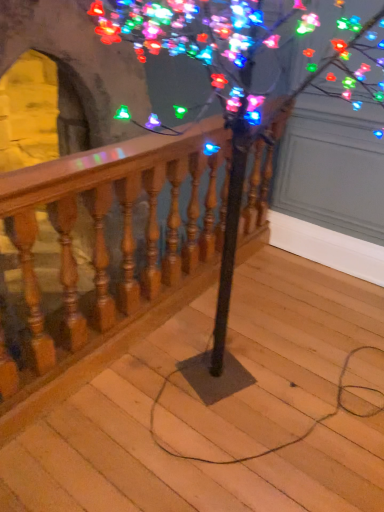
Question: Is multicolored lights at upper center positioned beyond the bounds of wooden at center?

Choices:
 (A) no
 (B) yes

Answer: (B)

Question: Does multicolored lights at upper center have a greater width compared to wooden at center?

Choices:
 (A) yes
 (B) no

Answer: (B)

Question: Is multicolored lights at upper center taller than wooden at center?

Choices:
 (A) yes
 (B) no

Answer: (A)

Question: Can you confirm if multicolored lights at upper center is smaller than wooden at center?

Choices:
 (A) no
 (B) yes

Answer: (A)

Question: Does multicolored lights at upper center have a larger size compared to wooden at center?

Choices:
 (A) yes
 (B) no

Answer: (A)

Question: Is multicolored lights at upper center thinner than wooden at center?

Choices:
 (A) no
 (B) yes

Answer: (B)

Question: Does multicolored lights at upper center come behind wooden baluster at center?

Choices:
 (A) yes
 (B) no

Answer: (B)

Question: From the image's perspective, does multicolored lights at upper center appear higher than wooden baluster at center?

Choices:
 (A) no
 (B) yes

Answer: (A)

Question: Is multicolored lights at upper center looking in the opposite direction of wooden baluster at center?

Choices:
 (A) yes
 (B) no

Answer: (A)

Question: Is multicolored lights at upper center wider than wooden baluster at center?

Choices:
 (A) no
 (B) yes

Answer: (B)

Question: Can wooden baluster at center be found inside multicolored lights at upper center?

Choices:
 (A) no
 (B) yes

Answer: (B)

Question: Is multicolored lights at upper center not close to wooden baluster at center?

Choices:
 (A) yes
 (B) no

Answer: (B)

Question: Is wooden baluster at center completely or partially inside wooden at center?

Choices:
 (A) yes
 (B) no

Answer: (B)